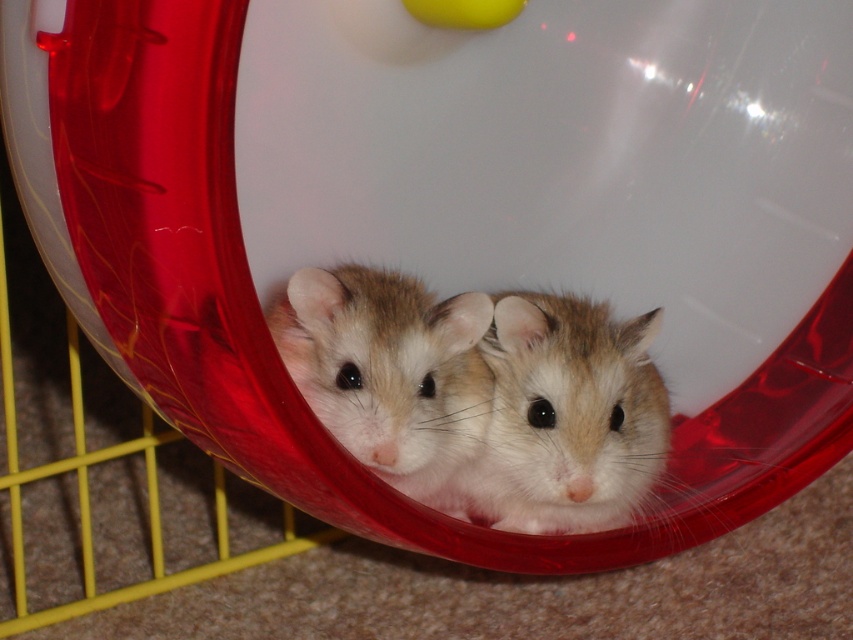
Does fuzzy beige mouse at center have a lesser height compared to fuzzy beige hamster at center?

Indeed, fuzzy beige mouse at center has a lesser height compared to fuzzy beige hamster at center.

This screenshot has height=640, width=853. Describe the element at coordinates (567, 417) in the screenshot. I see `fuzzy beige mouse at center` at that location.

Locate an element on the screen. fuzzy beige mouse at center is located at coordinates pos(567,417).